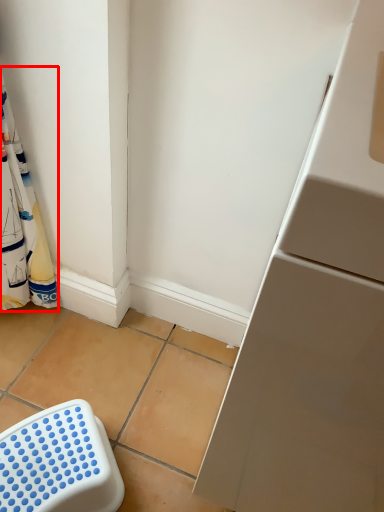
Question: Where is laundry (annotated by the red box) located in relation to furniture in the image?

Choices:
 (A) right
 (B) left

Answer: (B)